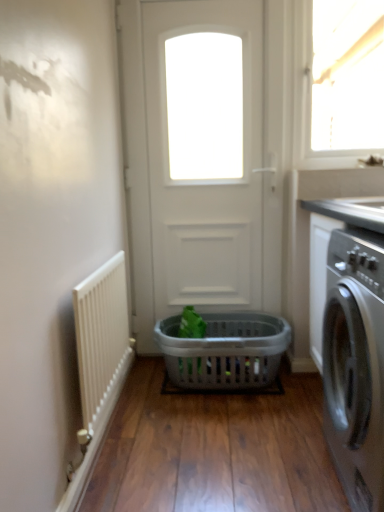
The width and height of the screenshot is (384, 512). Describe the element at coordinates (355, 364) in the screenshot. I see `satin black washing machine at right` at that location.

Where is `transparent glass window at upper right`? The image size is (384, 512). transparent glass window at upper right is located at coordinates (339, 82).

Describe the element at coordinates (100, 333) in the screenshot. This screenshot has height=512, width=384. I see `white textured radiator at left` at that location.

Where is `gray plastic basket at center`? The height and width of the screenshot is (512, 384). gray plastic basket at center is located at coordinates (224, 351).

In order to click on satin black washing machine at right in this screenshot , I will do `click(355, 364)`.

Where is `basket below the transparent glass window at upper right (from a real-world perspective)`? The image size is (384, 512). basket below the transparent glass window at upper right (from a real-world perspective) is located at coordinates (224, 351).

Could you tell me if transparent glass window at upper right is turned towards gray plastic basket at center?

No, transparent glass window at upper right is not turned towards gray plastic basket at center.

Does transparent glass window at upper right have a smaller size compared to gray plastic basket at center?

Yes.

Can you tell me how much transparent glass window at upper right and gray plastic basket at center differ in facing direction?

transparent glass window at upper right and gray plastic basket at center are facing 0.833 degrees away from each other.

Which is behind, point (111, 303) or point (378, 493)?

Positioned behind is point (111, 303).

Can you tell me how much white textured radiator at left and satin black washing machine at right differ in facing direction?

They differ by 179 degrees in their facing directions.

Is white textured radiator at left turned away from satin black washing machine at right?

No.

Is white textured radiator at left not within satin black washing machine at right?

Yes, white textured radiator at left is not within satin black washing machine at right.

Consider the image. From the image's perspective, is gray plastic basket at center located above or below white matte door at center?

Clearly, from the image's perspective, gray plastic basket at center is below white matte door at center.

Visually, is gray plastic basket at center positioned to the left or to the right of white matte door at center?

Clearly, gray plastic basket at center is on the right of white matte door at center in the image.

Is gray plastic basket at center situated inside white matte door at center or outside?

gray plastic basket at center lies outside white matte door at center.

Consider the image. Considering the sizes of objects gray plastic basket at center and white matte door at center in the image provided, who is bigger, gray plastic basket at center or white matte door at center?

white matte door at center.

Considering the positions of points (336, 297) and (259, 141), is point (336, 297) closer to camera compared to point (259, 141)?

Yes.

Between satin black washing machine at right and white matte door at center, which one has larger width?

satin black washing machine at right is wider.

From a real-world perspective, between satin black washing machine at right and white matte door at center, who is vertically lower?

From a 3D spatial view, satin black washing machine at right is below.

Which is behind, satin black washing machine at right or white matte door at center?

white matte door at center is further from the camera.

Considering the sizes of objects transparent glass window at upper right and white textured radiator at left in the image provided, who is smaller, transparent glass window at upper right or white textured radiator at left?

With smaller size is transparent glass window at upper right.

Is transparent glass window at upper right turned away from white textured radiator at left?

transparent glass window at upper right is not turned away from white textured radiator at left.

Considering their positions, is transparent glass window at upper right located in front of or behind white textured radiator at left?

transparent glass window at upper right is positioned farther from the viewer than white textured radiator at left.

Find the location of a particular element. The width and height of the screenshot is (384, 512). window located above the white textured radiator at left (from the image's perspective) is located at coordinates [339, 82].

Is white textured radiator at left surrounding white matte door at center?

No.

Would you say white textured radiator at left is a long distance from white matte door at center?

white textured radiator at left is actually quite close to white matte door at center.

How different are the orientations of white textured radiator at left and white matte door at center in degrees?

white textured radiator at left and white matte door at center are facing 90.8 degrees away from each other.

Is white textured radiator at left looking in the opposite direction of white matte door at center?

No, white matte door at center is not at the back of white textured radiator at left.

Which of these two, white matte door at center or gray plastic basket at center, is wider?

gray plastic basket at center.

From the image's perspective, which object appears higher, white matte door at center or gray plastic basket at center?

white matte door at center appears higher in the image.

Considering the sizes of objects white matte door at center and gray plastic basket at center in the image provided, who is shorter, white matte door at center or gray plastic basket at center?

Standing shorter between the two is gray plastic basket at center.

Where is `window that is behind the gray plastic basket at center`? window that is behind the gray plastic basket at center is located at coordinates (339, 82).

The height and width of the screenshot is (512, 384). I want to click on washing machine that appears on the right of white textured radiator at left, so click(355, 364).

Considering their positions, is transparent glass window at upper right positioned closer to satin black washing machine at right than gray plastic basket at center?

The object closer to satin black washing machine at right is gray plastic basket at center.

Based on their spatial positions, is white matte door at center or gray plastic basket at center further from satin black washing machine at right?

white matte door at center lies further to satin black washing machine at right than the other object.

Considering their positions, is white matte door at center positioned further to white textured radiator at left than transparent glass window at upper right?

transparent glass window at upper right is further to white textured radiator at left.

When comparing their distances from gray plastic basket at center, does satin black washing machine at right or white textured radiator at left seem closer?

white textured radiator at left is positioned closer to the anchor gray plastic basket at center.

Which object lies nearer to the anchor point gray plastic basket at center, transparent glass window at upper right or white textured radiator at left?

white textured radiator at left is closer to gray plastic basket at center.

Based on their spatial positions, is white textured radiator at left or satin black washing machine at right further from white matte door at center?

satin black washing machine at right.

When comparing their distances from transparent glass window at upper right, does white textured radiator at left or white matte door at center seem closer?

white matte door at center is positioned closer to the anchor transparent glass window at upper right.

From the image, which object appears to be nearer to transparent glass window at upper right, white matte door at center or satin black washing machine at right?

The object closer to transparent glass window at upper right is white matte door at center.

Where is `radiator between satin black washing machine at right and gray plastic basket at center in the front-back direction`? The height and width of the screenshot is (512, 384). radiator between satin black washing machine at right and gray plastic basket at center in the front-back direction is located at coordinates (100, 333).

Where is `door between transparent glass window at upper right and gray plastic basket at center from top to bottom`? The image size is (384, 512). door between transparent glass window at upper right and gray plastic basket at center from top to bottom is located at coordinates (203, 166).

Locate an element on the screen. Image resolution: width=384 pixels, height=512 pixels. washing machine that lies between transparent glass window at upper right and white textured radiator at left from top to bottom is located at coordinates (355, 364).

The width and height of the screenshot is (384, 512). I want to click on radiator between transparent glass window at upper right and gray plastic basket at center in the up-down direction, so click(100, 333).